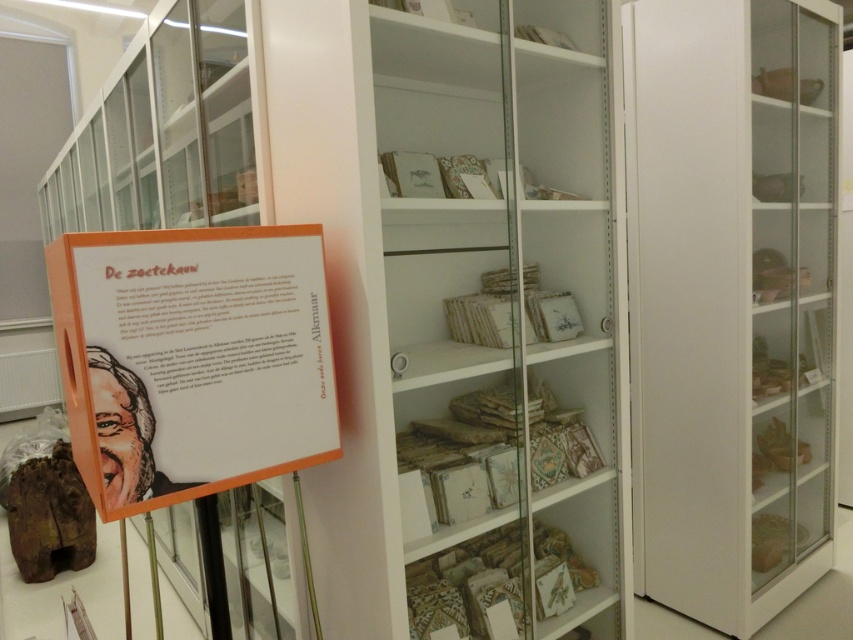
Looking at this image, you are an interior designer planning to place a 10cm wide decorative item between the matte white bookshelf at center and the white glossy bookshelf at center. Based on their widths, will there be enough space for the item?

The matte white bookshelf at center is thinner than the white glossy bookshelf at center, so the combined width of both bookshelves may leave insufficient space for a 10cm wide decorative item between them. However, without knowing their exact widths, it is impossible to determine definitively.

You are an art student visiting the museum and need to take notes on both the matte white bookshelf at center and the white glossy cabinet at right. Which object should you stand closer to if you want to observe both items simultaneously without moving your position?

You should stand closer to the matte white bookshelf at center because it is positioned to the left of the white glossy cabinet at right, allowing you to see both items within your field of view without moving.

You are an interior designer planning to place a new 1.2 meter wide sofa in this room. The sofa must be placed between the white glossy cabinet at right and the orange paper poster at center. Can the space between them accommodate the sofa?

The white glossy cabinet at right might be wider than orange paper poster at center, so the space between them may be sufficient to fit the 1.2 meter wide sofa, but it is uncertain without exact measurements.